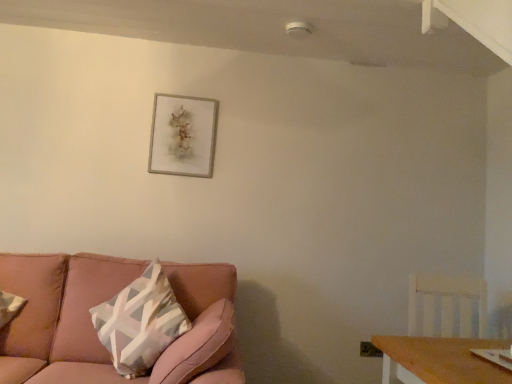
Question: Based on their positions, is white wood swivel chair at right located to the left or right of pink fabric couch at lower left?

Choices:
 (A) left
 (B) right

Answer: (B)

Question: Is point (414, 274) closer or farther from the camera than point (48, 370)?

Choices:
 (A) farther
 (B) closer

Answer: (A)

Question: Which is farther from the silver metallic picture frame at upper center?

Choices:
 (A) pink fabric couch at lower left
 (B) white wood swivel chair at right

Answer: (B)

Question: Estimate the real-world distances between objects in this image. Which object is farther from the silver metallic picture frame at upper center?

Choices:
 (A) white wood swivel chair at right
 (B) pink fabric couch at lower left

Answer: (A)